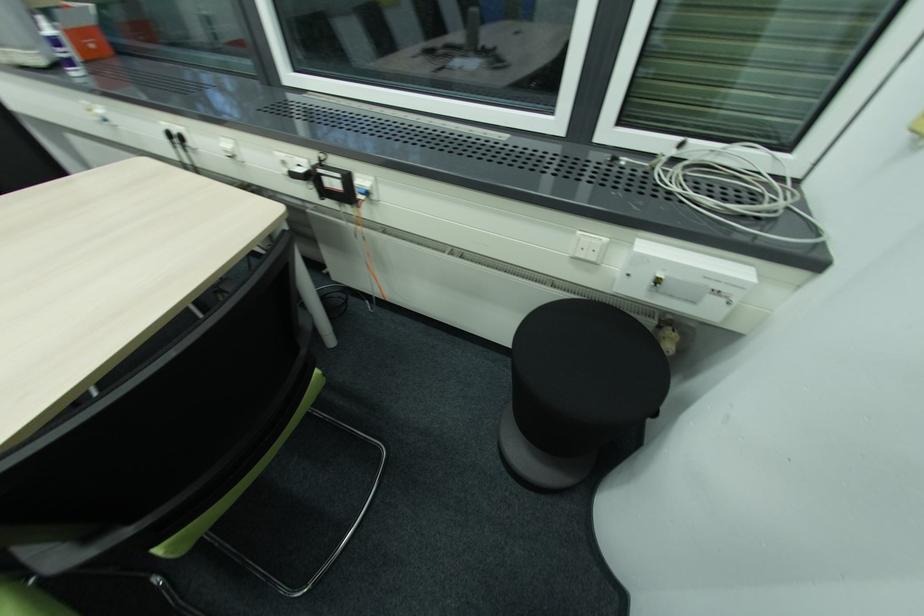
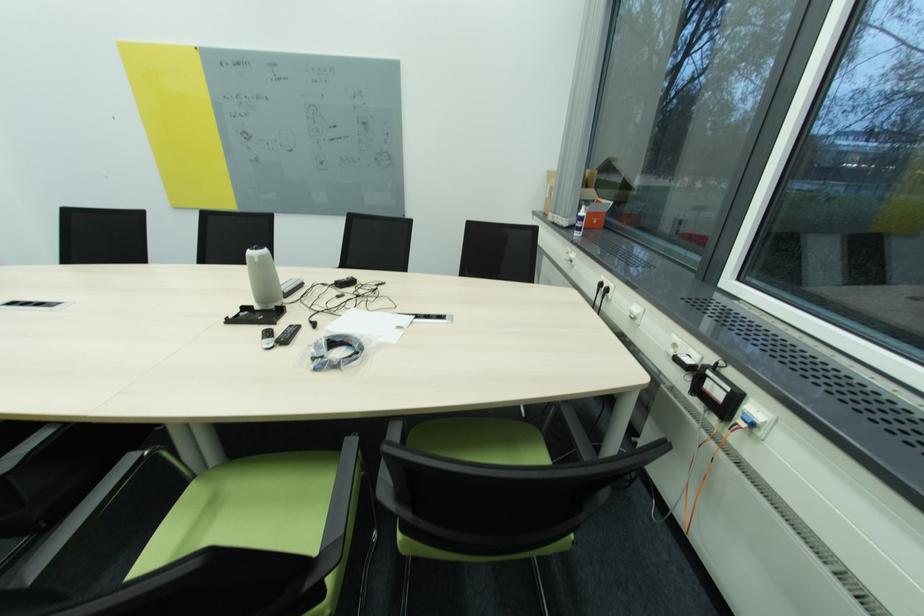
Where in the second image is the point corresponding to (x=231, y=152) from the first image?

(636, 314)